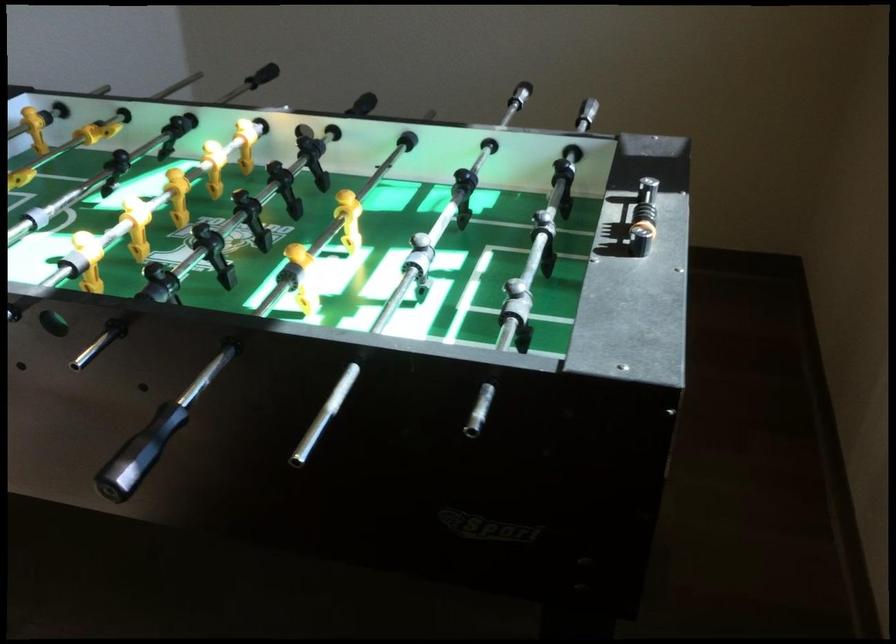
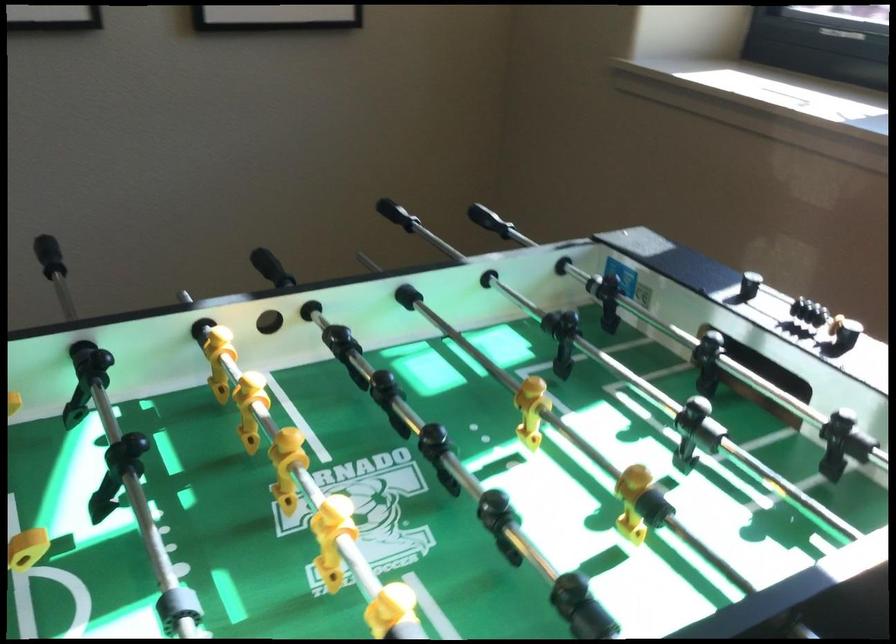
The point at (683, 219) is marked in the first image. Where is the corresponding point in the second image?

(798, 307)